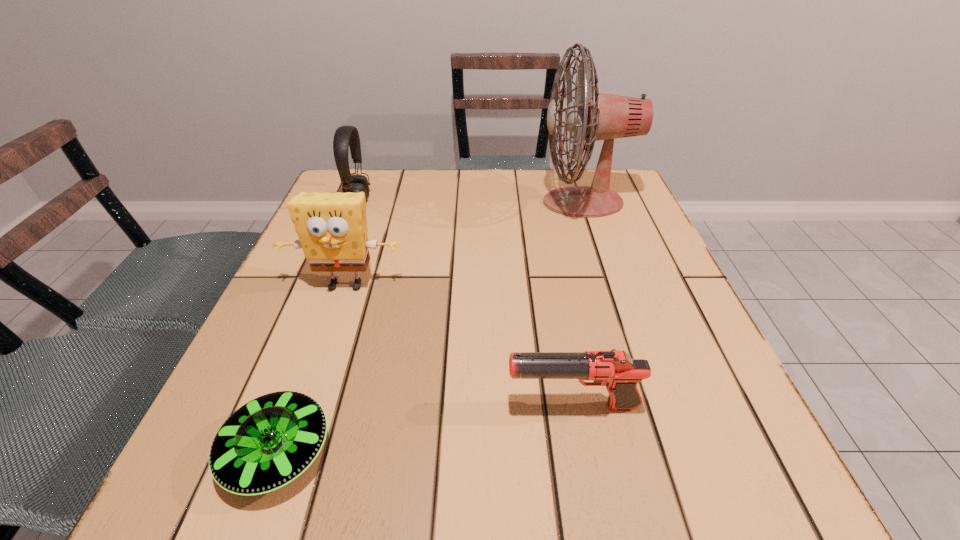
Identify the location of the tallest object. (594, 116).

Where is `the third farthest object`? The width and height of the screenshot is (960, 540). the third farthest object is located at coordinates (332, 228).

I want to click on headset, so click(345, 136).

Identify the location of the fourth tallest object. The width and height of the screenshot is (960, 540). (x=616, y=370).

This screenshot has height=540, width=960. In order to click on saucer in this screenshot , I will do `click(270, 441)`.

Locate an element on the screen. The image size is (960, 540). vacant space located 0.070m in front of the tallest object to direct airflow is located at coordinates (513, 202).

I want to click on vacant space located 0.130m in front of the tallest object to direct airflow, so click(490, 202).

This screenshot has width=960, height=540. Find the location of `vacant space positioned in front of the tallest object to direct airflow`. vacant space positioned in front of the tallest object to direct airflow is located at coordinates (402, 202).

Locate an element on the screen. This screenshot has width=960, height=540. vacant space located 0.290m on the face of the third farthest object is located at coordinates (295, 436).

Identify the location of vacant position located 0.290m on the front-facing side of the headset. This screenshot has height=540, width=960. (479, 200).